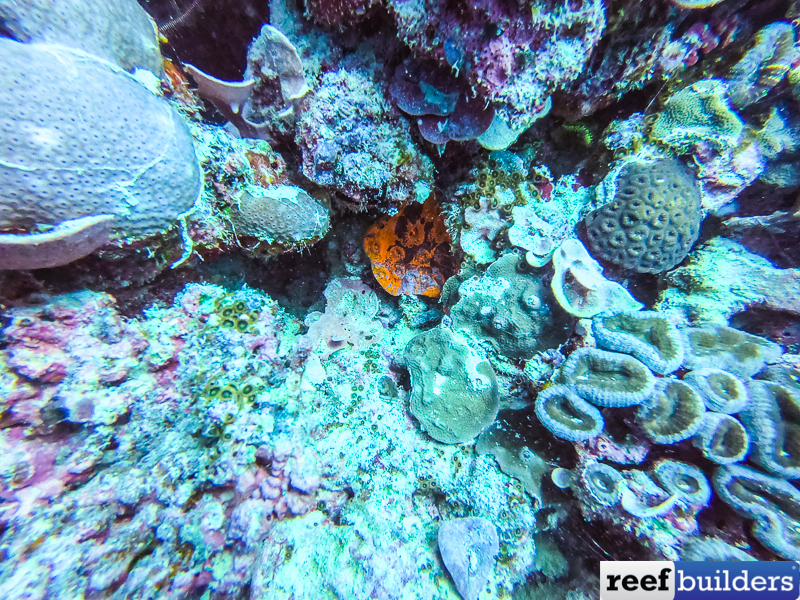
Locate an element on the screen. Image resolution: width=800 pixels, height=600 pixels. plant is located at coordinates (472, 572).